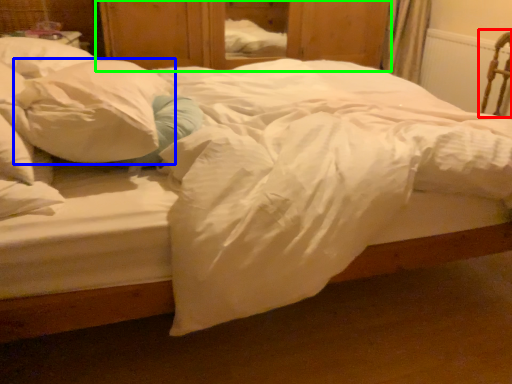
Question: Which object is positioned closest to armchair (highlighted by a red box)? Select from pillow (highlighted by a blue box) and dresser (highlighted by a green box).

Choices:
 (A) pillow
 (B) dresser

Answer: (B)